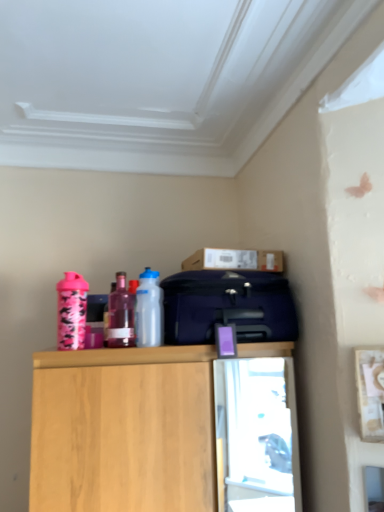
Question: Is cardboard box at upper center positioned behind translucent purple bottle at center, placed as the 2th bottle when sorted from left to right?

Choices:
 (A) yes
 (B) no

Answer: (A)

Question: Is cardboard box at upper center beside translucent purple bottle at center, placed as the 2th bottle when sorted from left to right?

Choices:
 (A) yes
 (B) no

Answer: (B)

Question: From a real-world perspective, does cardboard box at upper center sit lower than translucent purple bottle at center, marked as the second bottle in a right-to-left arrangement?

Choices:
 (A) no
 (B) yes

Answer: (A)

Question: From the image's perspective, would you say cardboard box at upper center is shown under translucent purple bottle at center, placed as the 2th bottle when sorted from left to right?

Choices:
 (A) no
 (B) yes

Answer: (A)

Question: From a real-world perspective, is cardboard box at upper center located higher than translucent purple bottle at center, marked as the second bottle in a right-to-left arrangement?

Choices:
 (A) no
 (B) yes

Answer: (B)

Question: Would you say matte blue suitcase at center is to the left or to the right of wooden cabinet at upper center in the picture?

Choices:
 (A) left
 (B) right

Answer: (B)

Question: Is matte blue suitcase at center in front of or behind wooden cabinet at upper center in the image?

Choices:
 (A) behind
 (B) front

Answer: (A)

Question: From a real-world perspective, relative to wooden cabinet at upper center, is matte blue suitcase at center vertically above or below?

Choices:
 (A) above
 (B) below

Answer: (A)

Question: Is matte blue suitcase at center wider or thinner than wooden cabinet at upper center?

Choices:
 (A) thin
 (B) wide

Answer: (A)

Question: Is cardboard box at upper center in front of or behind transparent plastic bottle at center, which is counted as the first bottle, starting from the right, in the image?

Choices:
 (A) front
 (B) behind

Answer: (B)

Question: Does point (213, 266) appear closer or farther from the camera than point (145, 309)?

Choices:
 (A) closer
 (B) farther

Answer: (B)

Question: Would you say cardboard box at upper center is inside or outside transparent plastic bottle at center, which is counted as the first bottle, starting from the right?

Choices:
 (A) inside
 (B) outside

Answer: (B)

Question: Is cardboard box at upper center wider or thinner than transparent plastic bottle at center, which is counted as the first bottle, starting from the right?

Choices:
 (A) wide
 (B) thin

Answer: (A)

Question: Does point (120, 278) appear closer or farther from the camera than point (248, 253)?

Choices:
 (A) farther
 (B) closer

Answer: (A)

Question: Is translucent purple bottle at center, marked as the second bottle in a right-to-left arrangement, inside the boundaries of cardboard box at upper center, or outside?

Choices:
 (A) inside
 (B) outside

Answer: (B)